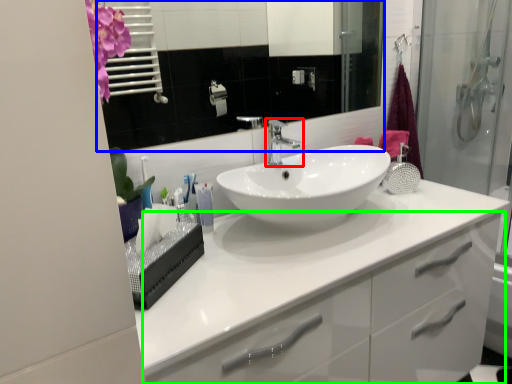
Question: Estimate the real-world distances between objects in this image. Which object is farther from tap (highlighted by a red box), mirror (highlighted by a blue box) or bathroom cabinet (highlighted by a green box)?

Choices:
 (A) mirror
 (B) bathroom cabinet

Answer: (A)